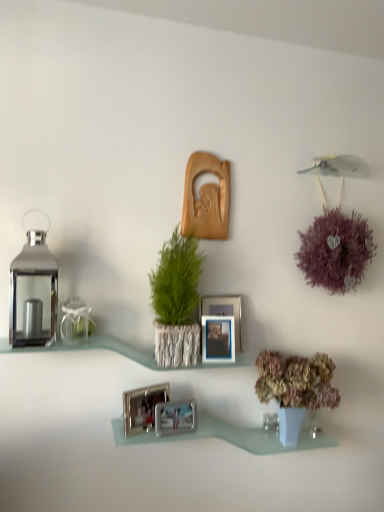
Question: Is clear glass shelf at center, which is the first shelf in top-to-bottom order, positioned behind purple fluffy ball at upper right?

Choices:
 (A) yes
 (B) no

Answer: (B)

Question: Is clear glass shelf at center, which is the first shelf in top-to-bottom order, next to purple fluffy ball at upper right and touching it?

Choices:
 (A) yes
 (B) no

Answer: (B)

Question: Is clear glass shelf at center, which is the first shelf in top-to-bottom order, bigger than purple fluffy ball at upper right?

Choices:
 (A) no
 (B) yes

Answer: (A)

Question: Is clear glass shelf at center, the second shelf ordered from the bottom, at the right side of purple fluffy ball at upper right?

Choices:
 (A) yes
 (B) no

Answer: (B)

Question: Could you tell me if clear glass shelf at center, which is the first shelf in top-to-bottom order, is turned towards purple fluffy ball at upper right?

Choices:
 (A) yes
 (B) no

Answer: (B)

Question: Based on their positions, is wooden carving at center, which is the fifth picture frame from bottom to top, located to the left or right of silver metallic picture frame at center, the 2th picture frame positioned from the top?

Choices:
 (A) left
 (B) right

Answer: (A)

Question: Is wooden carving at center, which appears as the first picture frame when viewed from the top, wider or thinner than silver metallic picture frame at center, which is the fourth picture frame from bottom to top?

Choices:
 (A) wide
 (B) thin

Answer: (B)

Question: Would you say wooden carving at center, which appears as the first picture frame when viewed from the top, is inside or outside silver metallic picture frame at center, which is the fourth picture frame from bottom to top?

Choices:
 (A) inside
 (B) outside

Answer: (B)

Question: Is wooden carving at center, which appears as the first picture frame when viewed from the top, in front of or behind silver metallic picture frame at center, the 2th picture frame positioned from the top, in the image?

Choices:
 (A) front
 (B) behind

Answer: (B)

Question: Looking at the image, does green textured plant at center seem bigger or smaller compared to silver metallic photo frame at lower center, the fourth picture frame viewed from the top?

Choices:
 (A) small
 (B) big

Answer: (B)

Question: From the image's perspective, is green textured plant at center positioned above or below silver metallic photo frame at lower center, the fourth picture frame viewed from the top?

Choices:
 (A) above
 (B) below

Answer: (A)

Question: From a real-world perspective, is green textured plant at center physically located above or below silver metallic photo frame at lower center, which appears as the second picture frame when ordered from the bottom?

Choices:
 (A) below
 (B) above

Answer: (B)

Question: Is green textured plant at center in front of or behind silver metallic photo frame at lower center, the fourth picture frame viewed from the top, in the image?

Choices:
 (A) front
 (B) behind

Answer: (A)

Question: Is point (165, 415) positioned closer to the camera than point (205, 336)?

Choices:
 (A) farther
 (B) closer

Answer: (B)

Question: Would you say silver metallic photo frame at center, arranged as the 1th picture frame when ordered from the bottom, is inside or outside metallic silver picture frame at center, which is the 3th picture frame in top-to-bottom order?

Choices:
 (A) outside
 (B) inside

Answer: (A)